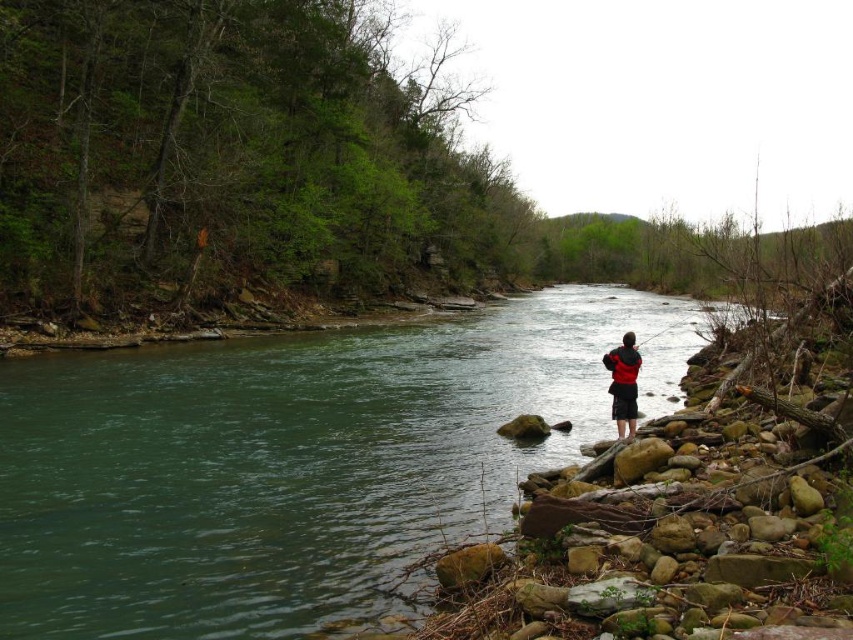
Is green smooth water at center further to the viewer compared to red fabric jacket at center?

No, green smooth water at center is closer to the viewer.

Which is behind, point (322, 552) or point (627, 428)?

The point (627, 428) is more distant.

Where is `green smooth water at center`? The width and height of the screenshot is (853, 640). green smooth water at center is located at coordinates (294, 461).